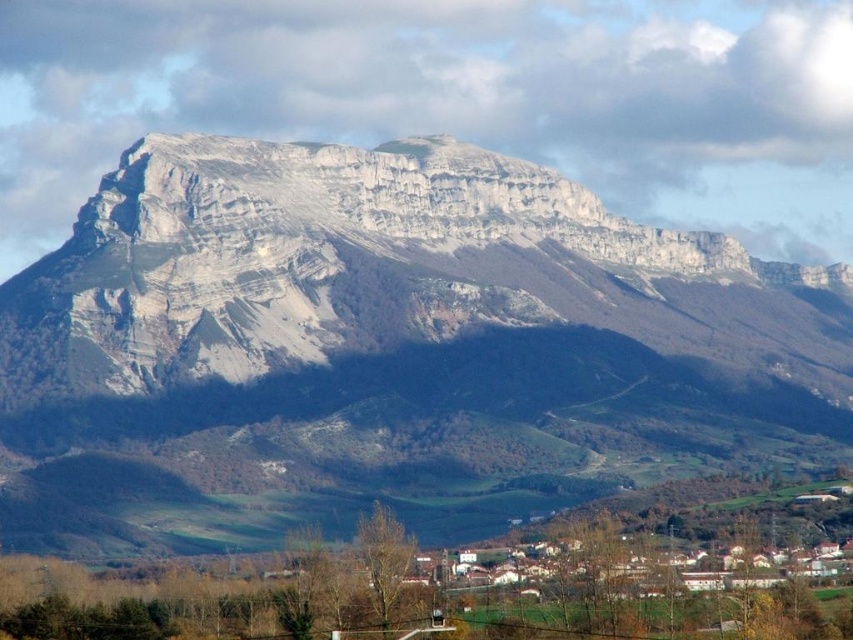
You are standing at the point with coordinates (386, 348) in the image. What can you see directly in front of you?

At point (386, 348) lies white rocky mountain range at upper center, so you can see the white rocky mountain range at upper center directly in front of you.

You are standing at the camera position and want to reach the point marked at coordinates [646,336]. If your walking speed is 5 km per hour, how long will it take you to reach that point?

The point at [646,336] is 658.15 meters away from the camera. Converting meters to kilometers, that is 0.65815 kilometers. At a walking speed of 5 km per hour, the time required would be distance divided by speed, so 0.65815 km divided by 5 km per hour equals approximately 0.1316 hours. Multiplying this by 60 minutes gives roughly 7.9 minutes. Therefore, it would take approximately 8 minutes to reach the point.